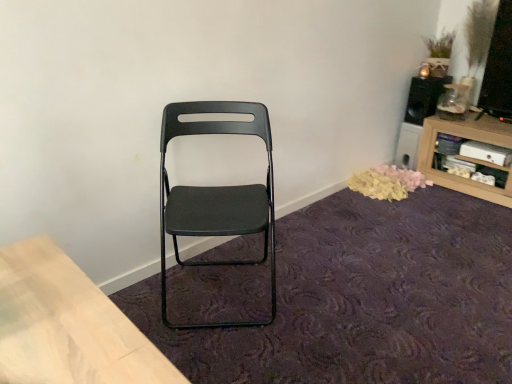
Locate an element on the screen. vacant space in front of matte black folding chair at center is located at coordinates (240, 356).